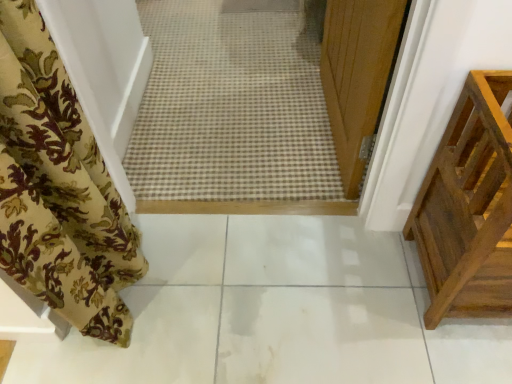
This screenshot has width=512, height=384. Identify the location of white glossy tile at center. (276, 312).

Is white glossy tile at center inside brown wooden crate at right?

No, white glossy tile at center is not a part of brown wooden crate at right.

From a real-world perspective, who is located higher, brown wooden crate at right or white glossy tile at center?

brown wooden crate at right is physically above.

Considering the positions of objects brown wooden crate at right and white glossy tile at center in the image provided, who is more to the right, brown wooden crate at right or white glossy tile at center?

Positioned to the right is brown wooden crate at right.

Considering the relative sizes of white glossy tile at center and floral fabric curtain at left in the image provided, is white glossy tile at center thinner than floral fabric curtain at left?

Incorrect, the width of white glossy tile at center is not less than that of floral fabric curtain at left.

Can you confirm if white glossy tile at center is taller than floral fabric curtain at left?

No.

Looking at this image, is the depth of white glossy tile at center greater than that of brown wooden crate at right?

Yes.

Consider the image. Does white glossy tile at center appear on the left side of brown wooden crate at right?

Yes.

Is white glossy tile at center not close to brown wooden crate at right?

white glossy tile at center is actually quite close to brown wooden crate at right.

Consider the image. How distant is white glossy tile at center from brown wooden crate at right?

40.69 centimeters.

From the image's perspective, which one is positioned lower, brown wooden crate at right or floral fabric curtain at left?

brown wooden crate at right is shown below in the image.

Considering the relative sizes of brown wooden crate at right and floral fabric curtain at left in the image provided, is brown wooden crate at right thinner than floral fabric curtain at left?

Incorrect, the width of brown wooden crate at right is not less than that of floral fabric curtain at left.

Is brown wooden crate at right far from floral fabric curtain at left?

No, brown wooden crate at right is not far away from floral fabric curtain at left.

Find the location of a particular element. The width and height of the screenshot is (512, 384). furniture that appears below the floral fabric curtain at left (from the image's perspective) is located at coordinates (469, 207).

Between floral fabric curtain at left and white glossy tile at center, which one has less height?

With less height is white glossy tile at center.

Is floral fabric curtain at left to the left or to the right of white glossy tile at center in the image?

Based on their positions, floral fabric curtain at left is located to the left of white glossy tile at center.

Is floral fabric curtain at left touching white glossy tile at center?

No, floral fabric curtain at left is not touching white glossy tile at center.

From a real-world perspective, is floral fabric curtain at left positioned above or below white glossy tile at center?

From a real-world perspective, floral fabric curtain at left is physically above white glossy tile at center.

Does floral fabric curtain at left have a lesser height compared to brown wooden crate at right?

No, floral fabric curtain at left is not shorter than brown wooden crate at right.

Is floral fabric curtain at left positioned with its back to brown wooden crate at right?

No, brown wooden crate at right is not at the back of floral fabric curtain at left.

Which object is positioned more to the left, floral fabric curtain at left or brown wooden crate at right?

From the viewer's perspective, floral fabric curtain at left appears more on the left side.

The height and width of the screenshot is (384, 512). In order to click on furniture on the right of white glossy tile at center in this screenshot , I will do `click(469, 207)`.

This screenshot has width=512, height=384. There is a white glossy tile at center. In order to click on curtain above it (from a real-world perspective) in this screenshot , I will do `click(59, 188)`.

Considering their positions, is white glossy tile at center positioned further to brown wooden crate at right than floral fabric curtain at left?

The object further to brown wooden crate at right is floral fabric curtain at left.

When comparing their distances from brown wooden crate at right, does floral fabric curtain at left or white glossy tile at center seem closer?

Based on the image, white glossy tile at center appears to be nearer to brown wooden crate at right.

Estimate the real-world distances between objects in this image. Which object is further from white glossy tile at center, floral fabric curtain at left or brown wooden crate at right?

The object further to white glossy tile at center is floral fabric curtain at left.

Estimate the real-world distances between objects in this image. Which object is further from floral fabric curtain at left, brown wooden crate at right or white glossy tile at center?

brown wooden crate at right lies further to floral fabric curtain at left than the other object.

Based on their spatial positions, is white glossy tile at center or brown wooden crate at right closer to floral fabric curtain at left?

white glossy tile at center lies closer to floral fabric curtain at left than the other object.

Based on their spatial positions, is brown wooden crate at right or floral fabric curtain at left further from white glossy tile at center?

Based on the image, floral fabric curtain at left appears to be further to white glossy tile at center.

The height and width of the screenshot is (384, 512). I want to click on path between floral fabric curtain at left and brown wooden crate at right, so click(x=276, y=312).